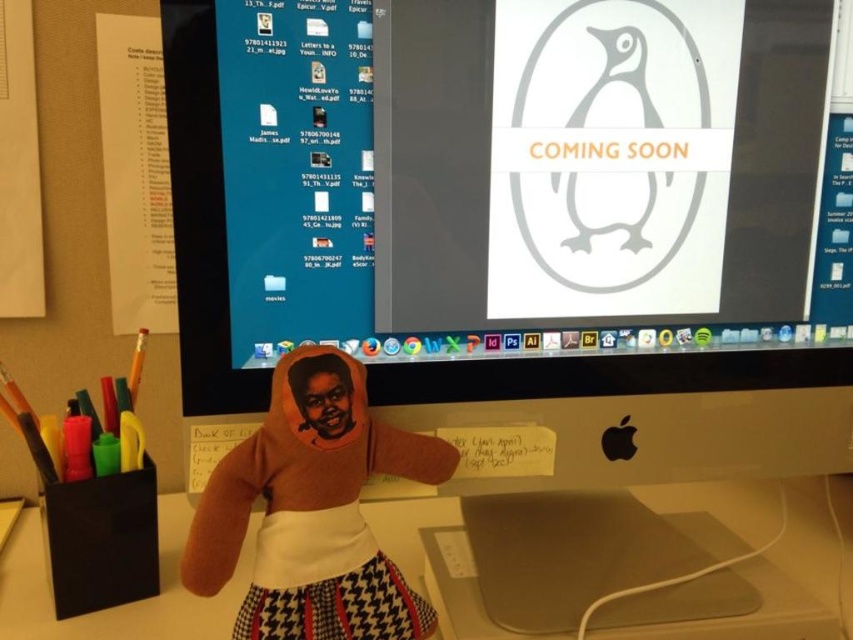
Question: From the image, what is the correct spatial relationship of brown plush doll at center in relation to white plastic computer desk at center?

Choices:
 (A) left
 (B) right

Answer: (A)

Question: Which point appears farthest from the camera in this image?

Choices:
 (A) (270, 609)
 (B) (398, 547)

Answer: (B)

Question: Does brown plush doll at center appear under white plastic computer desk at center?

Choices:
 (A) yes
 (B) no

Answer: (B)

Question: Is brown plush doll at center smaller than white plastic computer desk at center?

Choices:
 (A) no
 (B) yes

Answer: (B)